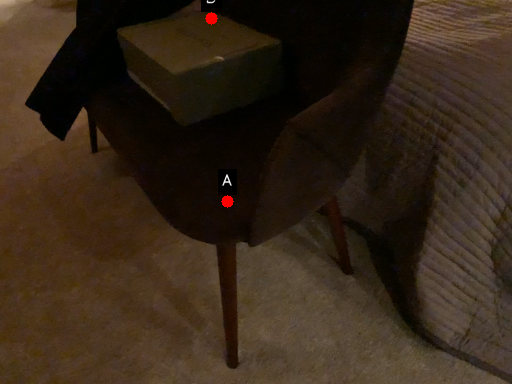
Question: Two points are circled on the image, labeled by A and B beside each circle. Which of the following is the farthest from the observer?

Choices:
 (A) A is further
 (B) B is further

Answer: (B)